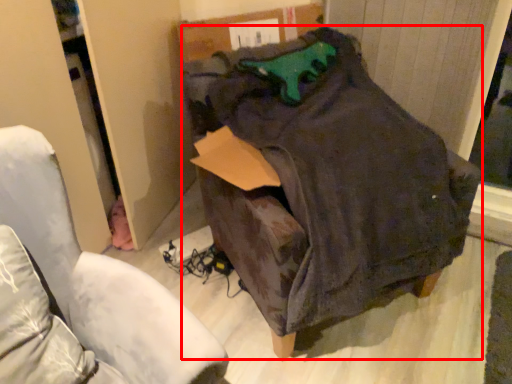
Question: Where is bean bag chair (annotated by the red box) located in relation to furniture in the image?

Choices:
 (A) left
 (B) right

Answer: (B)